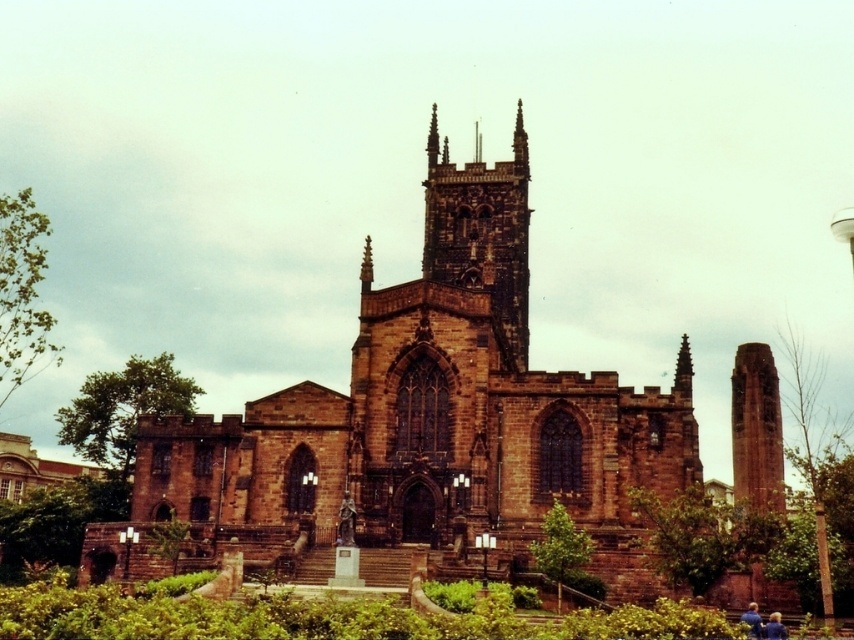
Does brown stone church at center appear on the left side of red brick tower at center?

Correct, you'll find brown stone church at center to the left of red brick tower at center.

Can you confirm if brown stone church at center is smaller than red brick tower at center?

No, brown stone church at center is not smaller than red brick tower at center.

The width and height of the screenshot is (854, 640). I want to click on brown stone church at center, so click(x=423, y=422).

You are a GUI agent. You are given a task and a screenshot of the screen. Output one action in this format:
    pyautogui.click(x=<x>, y=<y>)
    Task: Click on the brown stone church at center
    
    Given the screenshot: What is the action you would take?
    pyautogui.click(x=423, y=422)

Which is behind, point (459, 483) or point (478, 179)?

The point (478, 179) is more distant.

Is brown stone church at center positioned before brown stone tower at center?

Yes, it is.

Is point (389, 323) closer to camera compared to point (496, 266)?

Yes, point (389, 323) is in front of point (496, 266).

Where is `brown stone church at center`? brown stone church at center is located at coordinates (423, 422).

You are a GUI agent. You are given a task and a screenshot of the screen. Output one action in this format:
    pyautogui.click(x=<x>, y=<y>)
    Task: Click on the brown stone tower at center
    This screenshot has width=854, height=640.
    Given the screenshot: What is the action you would take?
    pyautogui.click(x=481, y=230)

Locate an element on the screen. brown stone tower at center is located at coordinates (481, 230).

You are a GUI agent. You are given a task and a screenshot of the screen. Output one action in this format:
    pyautogui.click(x=<x>, y=<y>)
    Task: Click on the brown stone tower at center
    
    Given the screenshot: What is the action you would take?
    (481, 230)